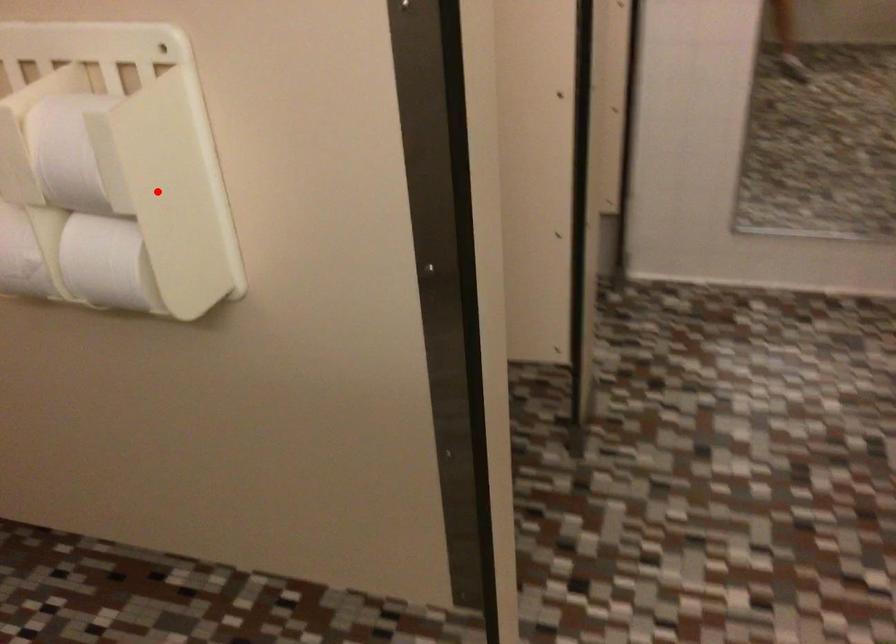
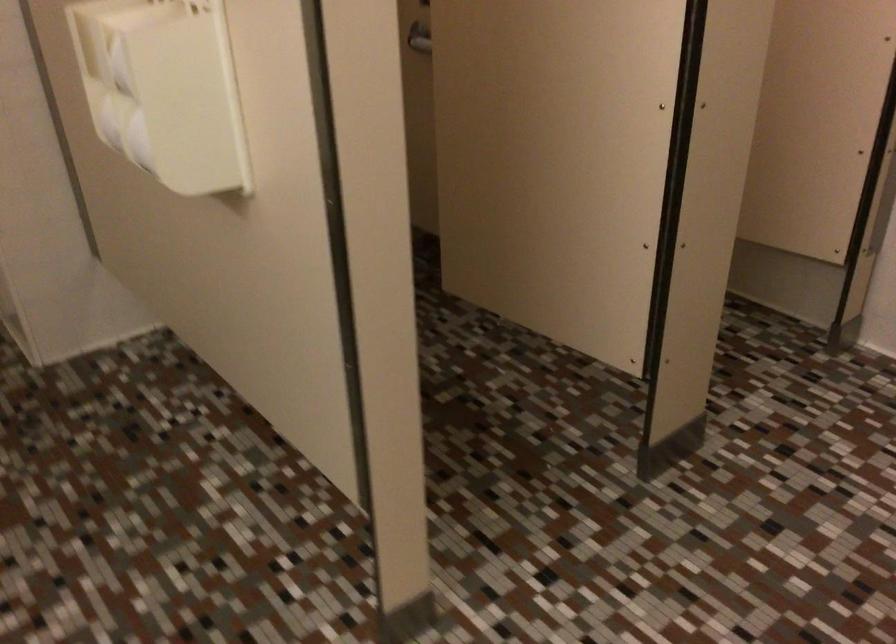
Question: I am providing you with two images of the same scene from different viewpoints. A red point is shown in image1. For the corresponding object point in image2, is it positioned nearer or farther from the camera?

Choices:
 (A) Nearer
 (B) Farther

Answer: (B)